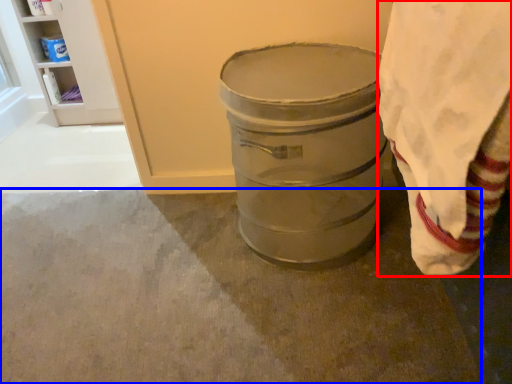
Question: Which point is closer to the camera, cloth (highlighted by a red box) or concrete (highlighted by a blue box)?

Choices:
 (A) cloth
 (B) concrete

Answer: (A)